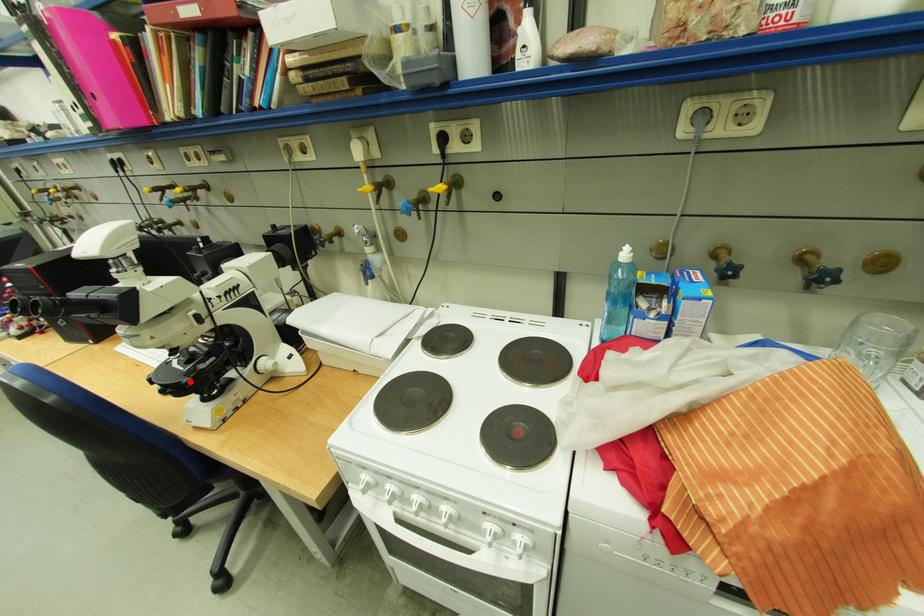
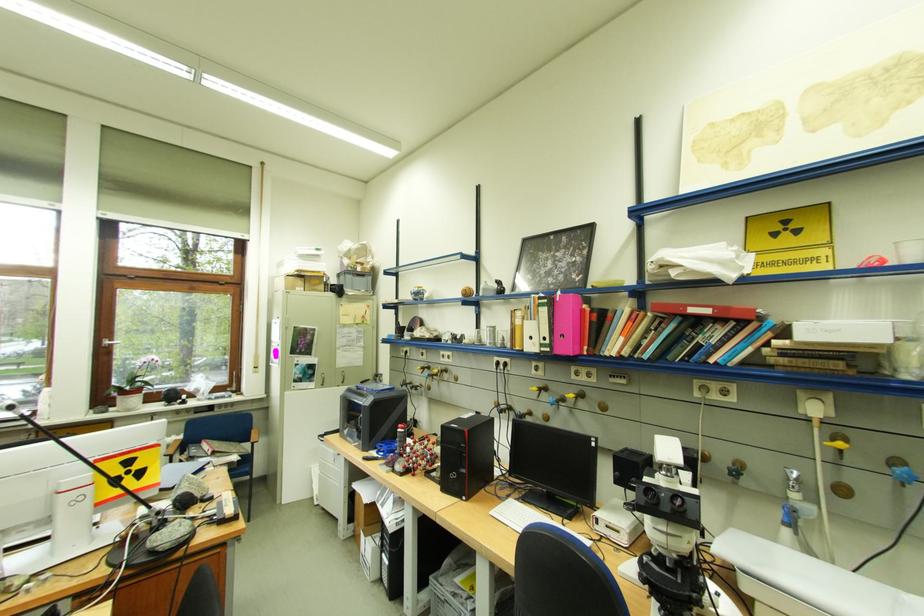
Question: A red point is marked in image1. In image2, is the corresponding 3D point closer to the camera or farther? Reply with the corresponding letter.

Choices:
 (A) The corresponding 3D point is closer.
 (B) The corresponding 3D point is farther.

Answer: (A)